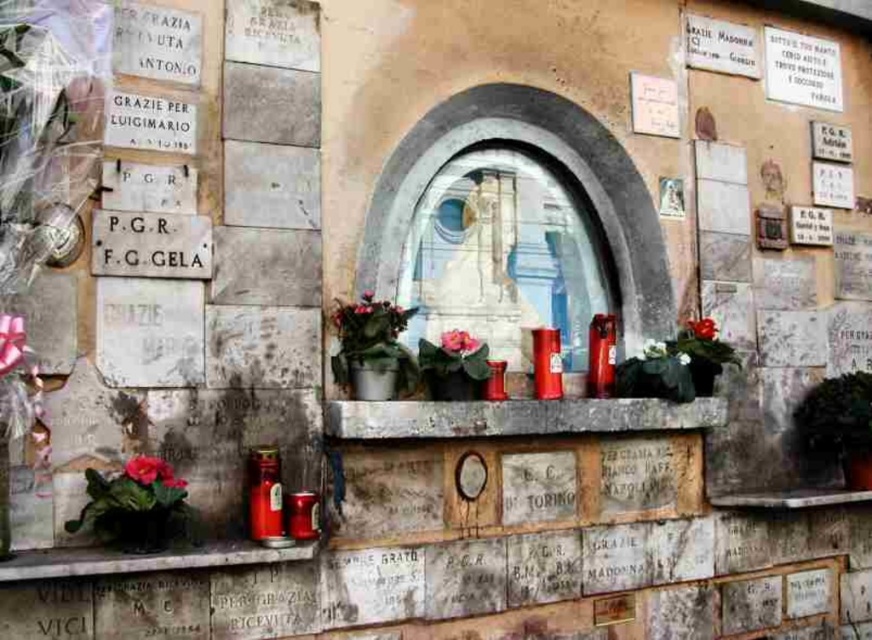
You are a maintenance worker tasked with cleaning the area between the matte concrete ledge at lower left and the pink matte flower at center. Your cleaning tool has a 3 feet long handle. Can you reach the farthest point between these two objects without moving closer?

The distance between the matte concrete ledge at lower left and the pink matte flower at center is 3.30 feet. Since your tool has a 3 feet handle, you cannot fully reach the farthest point as it is slightly beyond the tool length.

You are standing in front of the niche and want to place a new plaque between the pink matte flower at center and the green matte flower at center. Which flower should you place the plaque closer to if you want it to be closer to the top of the niche?

The pink matte flower at center is located above the green matte flower at center, so placing the plaque closer to the pink matte flower at center will position it nearer to the top of the niche.